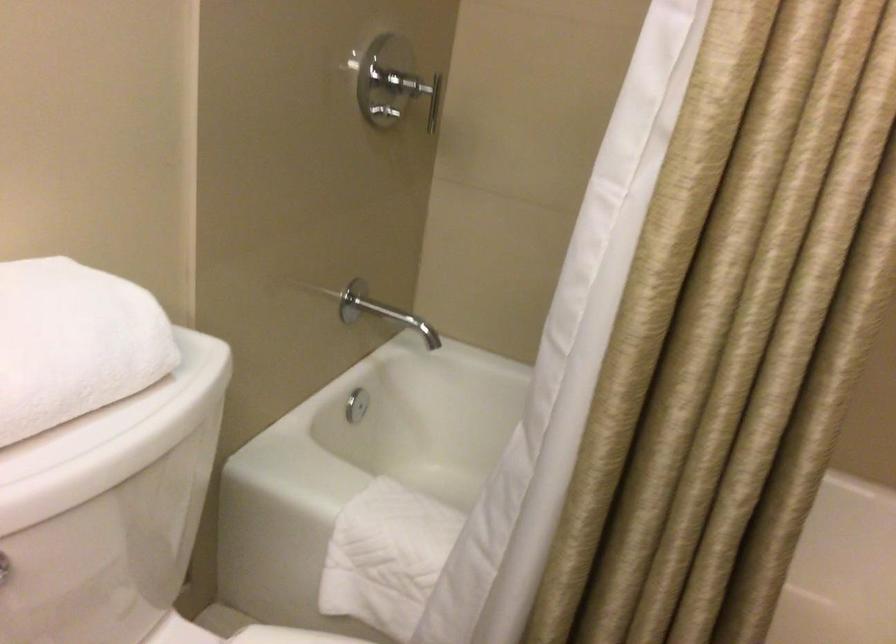
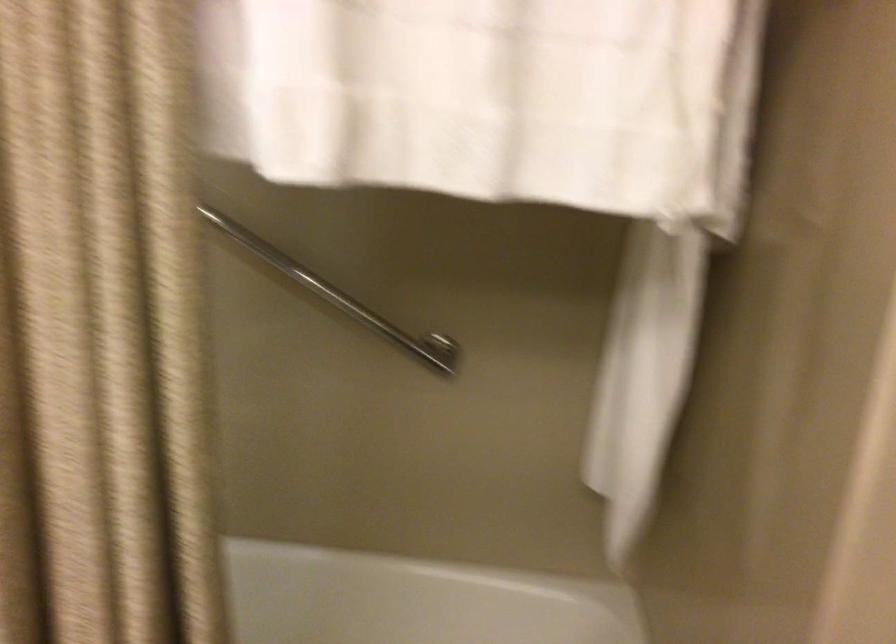
Question: The images are taken continuously from a first-person perspective. In which direction are you moving?

Choices:
 (A) Left
 (B) Right
 (C) Forward
 (D) Backward

Answer: (B)